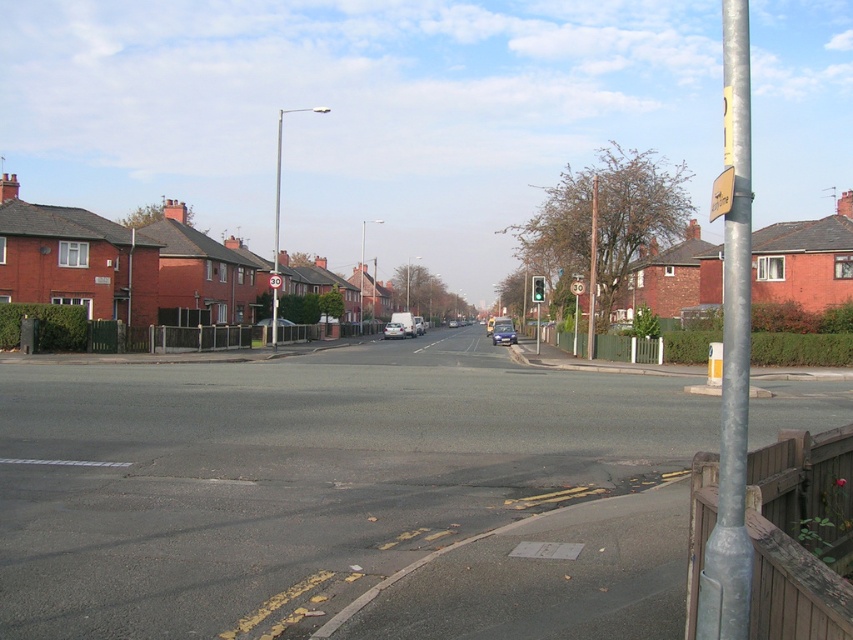
Question: Which object is farther from the camera taking this photo?

Choices:
 (A) silver metallic pole at right
 (B) metallic silver sedan at center

Answer: (B)

Question: Does metallic pole at center appear on the left side of yellow plastic sign at upper right?

Choices:
 (A) yes
 (B) no

Answer: (A)

Question: Is silver metallic pole at right closer to camera compared to matte silver van at center?

Choices:
 (A) yes
 (B) no

Answer: (A)

Question: Which of these objects is positioned farthest from the red plastic sign at center?

Choices:
 (A) silver metallic pole at right
 (B) green glass traffic light at center
 (C) matte silver van at center
 (D) metallic silver sedan at center

Answer: (D)

Question: Which object is the farthest from the yellow plastic sign at upper right?

Choices:
 (A) metallic silver sedan at center
 (B) metallic circular speed limit sign at center
 (C) metallic silver car at center

Answer: (A)

Question: Is yellow plastic sign at upper right to the left of metallic silver car at center from the viewer's perspective?

Choices:
 (A) yes
 (B) no

Answer: (B)